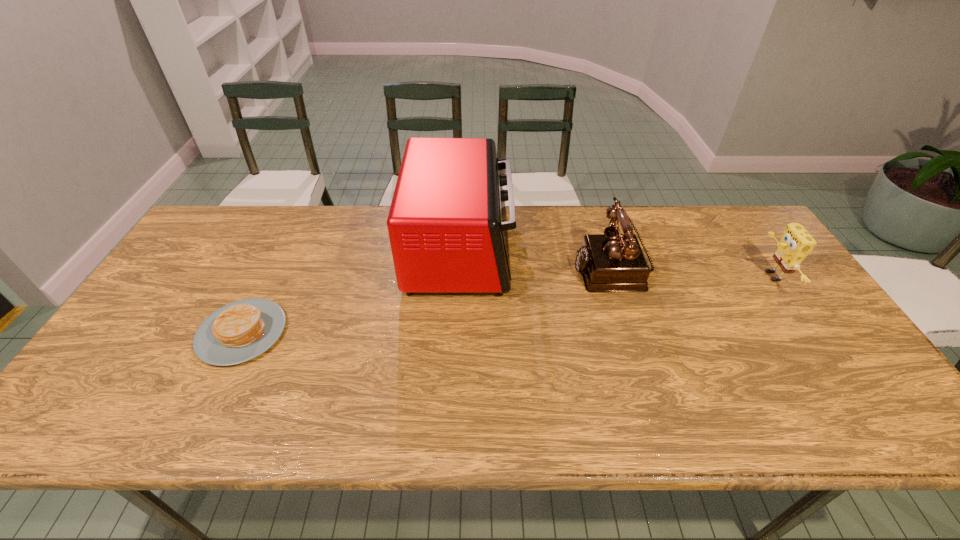
I want to click on toaster oven, so click(447, 224).

Find the location of a particular element. The image size is (960, 540). the tallest object is located at coordinates (447, 224).

Where is `the third object from left to right`? This screenshot has height=540, width=960. the third object from left to right is located at coordinates (611, 262).

Identify the location of telephone. The height and width of the screenshot is (540, 960). (611, 262).

You are a GUI agent. You are given a task and a screenshot of the screen. Output one action in this format:
    pyautogui.click(x=<x>, y=<y>)
    Task: Click on the second shortest object
    The image size is (960, 540).
    Given the screenshot: What is the action you would take?
    pyautogui.click(x=796, y=243)

The width and height of the screenshot is (960, 540). Identify the location of sponge. (796, 243).

You are a GUI agent. You are given a task and a screenshot of the screen. Output one action in this format:
    pyautogui.click(x=<x>, y=<y>)
    Task: Click on the pancake
    Image resolution: width=960 pixels, height=540 pixels.
    Given the screenshot: What is the action you would take?
    pyautogui.click(x=240, y=331)

You are a GUI agent. You are given a task and a screenshot of the screen. Output one action in this format:
    pyautogui.click(x=<x>, y=<y>)
    Task: Click on the leftmost object
    
    Given the screenshot: What is the action you would take?
    pyautogui.click(x=240, y=331)

At what (x,y) coordinates should I click in order to perform the action: click on free space located 0.360m on the front-facing side of the second object from left to right. Please return your answer as a coordinate pair (x, y). The image size is (960, 540). Looking at the image, I should click on (630, 249).

Where is `free region located 0.320m on the dial of the second tallest object`? free region located 0.320m on the dial of the second tallest object is located at coordinates (467, 267).